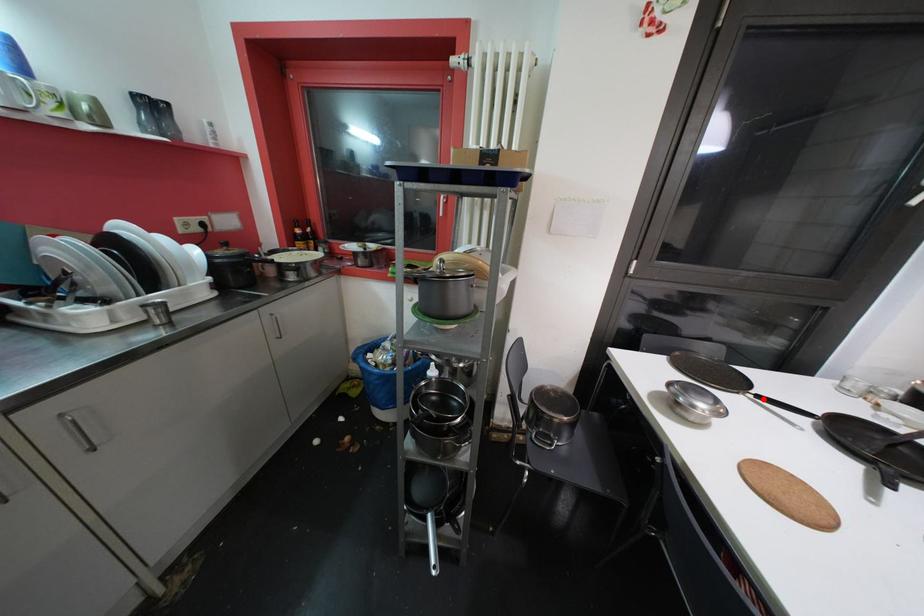
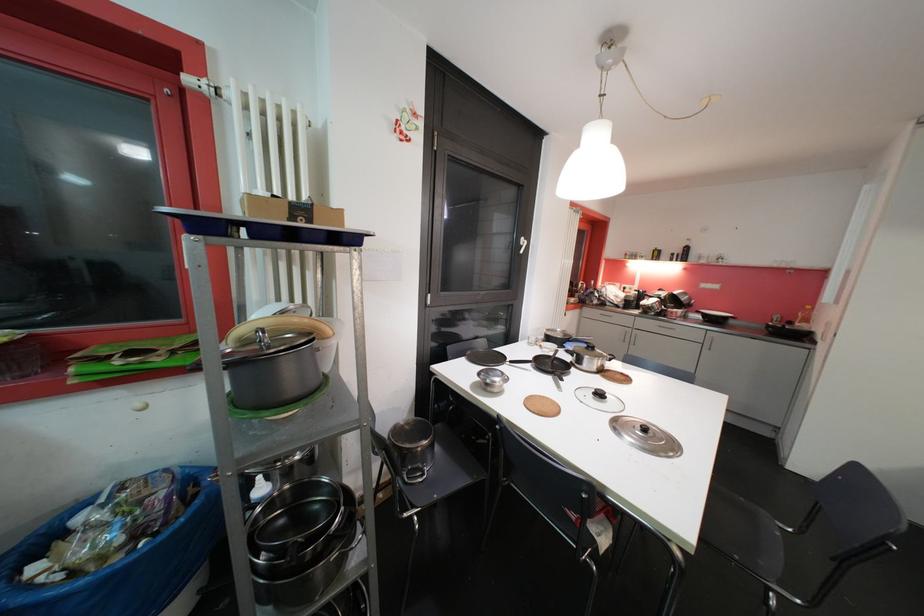
Locate, in the second image, the point that corresponds to the highlighted location in the first image.

(516, 363)